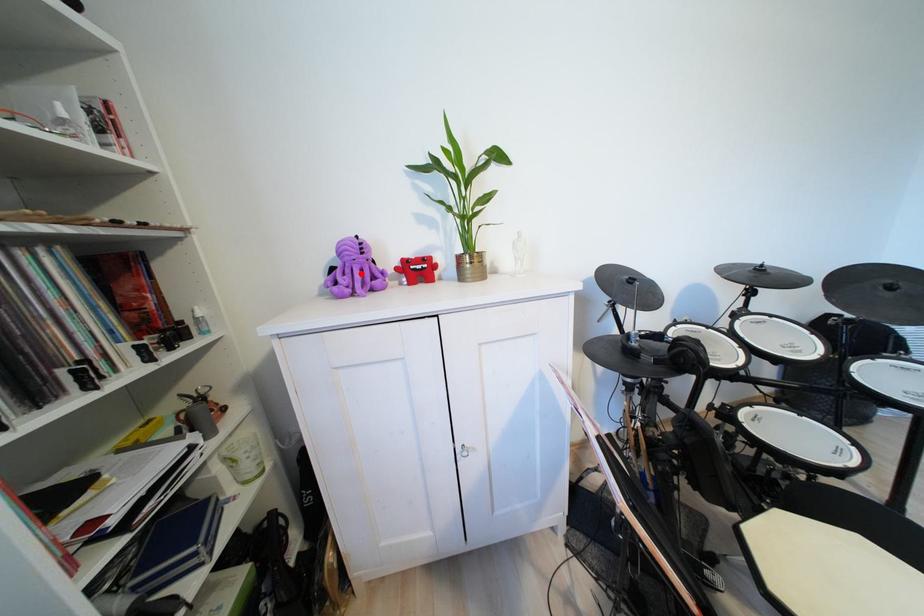
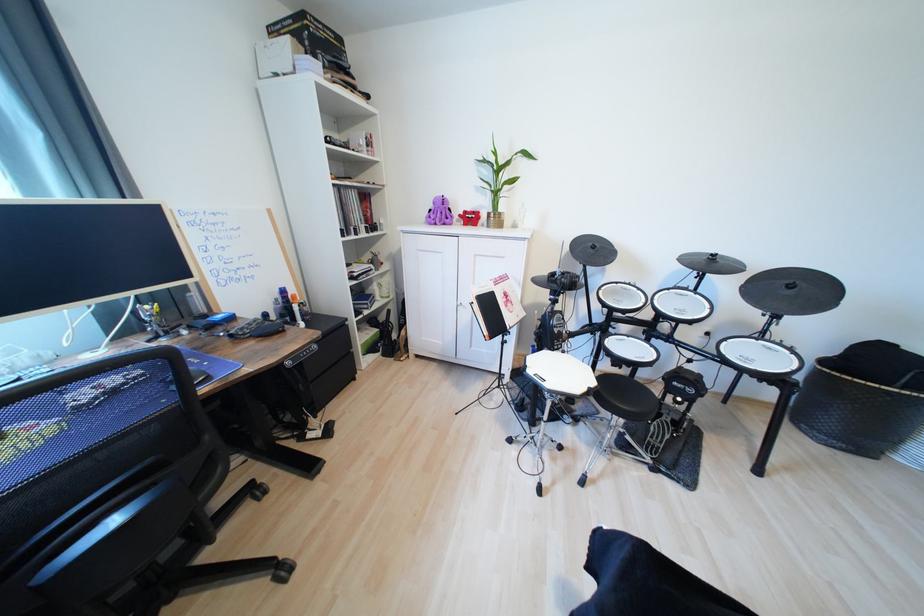
Find the pixel in the second image that matches the highlighted location in the first image.

(447, 216)